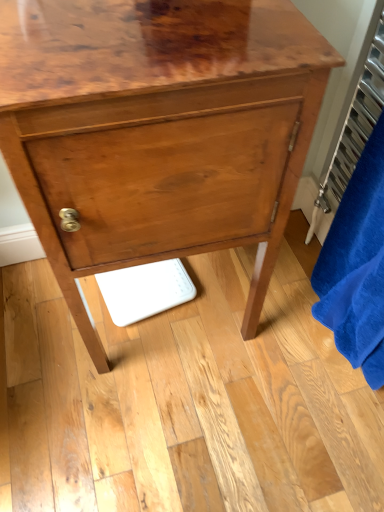
This screenshot has height=512, width=384. What are the coordinates of `blue plush bath towel at right` in the screenshot? It's located at (357, 266).

Measure the distance between metallic silver radiator at right and camera.

The depth of metallic silver radiator at right is 29.74 inches.

Consider the image. Measure the distance between point [130,2] and camera.

Point [130,2] is 24.37 inches away from camera.

The width and height of the screenshot is (384, 512). What are the coordinates of `blue plush bath towel at right` in the screenshot? It's located at (357, 266).

Can we say glossy wood chest of drawers at center lies outside metallic silver radiator at right?

Yes, glossy wood chest of drawers at center is not within metallic silver radiator at right.

From the image's perspective, is glossy wood chest of drawers at center above or below metallic silver radiator at right?

glossy wood chest of drawers at center is below metallic silver radiator at right.

Is glossy wood chest of drawers at center wider than metallic silver radiator at right?

Yes.

Considering the positions of points (108, 1) and (370, 60), is point (108, 1) closer to camera compared to point (370, 60)?

Yes, it is.

Looking at this image, from the image's perspective, is metallic silver radiator at right under glossy wood chest of drawers at center?

No.

Consider the image. Considering the relative positions of metallic silver radiator at right and glossy wood chest of drawers at center in the image provided, is metallic silver radiator at right to the left or to the right of glossy wood chest of drawers at center?

From the image, it's evident that metallic silver radiator at right is to the right of glossy wood chest of drawers at center.

Is metallic silver radiator at right situated inside glossy wood chest of drawers at center or outside?

metallic silver radiator at right is outside glossy wood chest of drawers at center.

Is metallic silver radiator at right facing towards glossy wood chest of drawers at center?

Yes, metallic silver radiator at right faces towards glossy wood chest of drawers at center.

Could blue plush bath towel at right be considered to be inside metallic silver radiator at right?

No, blue plush bath towel at right is located outside of metallic silver radiator at right.

Can you confirm if metallic silver radiator at right is taller than blue plush bath towel at right?

In fact, metallic silver radiator at right may be shorter than blue plush bath towel at right.

Who is more distant, metallic silver radiator at right or blue plush bath towel at right?

metallic silver radiator at right is more distant.

Consider the image. Is the surface of metallic silver radiator at right in direct contact with blue plush bath towel at right?

They are not placed beside each other.

Considering their positions, is blue plush bath towel at right located in front of or behind glossy wood chest of drawers at center?

blue plush bath towel at right is positioned closer to the viewer than glossy wood chest of drawers at center.

Who is taller, blue plush bath towel at right or glossy wood chest of drawers at center?

glossy wood chest of drawers at center.

From a real-world perspective, is blue plush bath towel at right physically located above or below glossy wood chest of drawers at center?

blue plush bath towel at right is above glossy wood chest of drawers at center.

From the image's perspective, which one is positioned higher, blue plush bath towel at right or glossy wood chest of drawers at center?

glossy wood chest of drawers at center appears higher in the image.

Is glossy wood chest of drawers at center oriented away from blue plush bath towel at right?

No, glossy wood chest of drawers at center's orientation is not away from blue plush bath towel at right.

Consider the image. Considering the relative sizes of glossy wood chest of drawers at center and blue plush bath towel at right in the image provided, is glossy wood chest of drawers at center taller than blue plush bath towel at right?

Indeed, glossy wood chest of drawers at center has a greater height compared to blue plush bath towel at right.

From a real-world perspective, does glossy wood chest of drawers at center sit lower than blue plush bath towel at right?

Yes, from a real-world perspective, glossy wood chest of drawers at center is under blue plush bath towel at right.

From the image's perspective, does blue plush bath towel at right appear higher than metallic silver radiator at right?

No, from the image's perspective, blue plush bath towel at right is not above metallic silver radiator at right.

In terms of height, does blue plush bath towel at right look taller or shorter compared to metallic silver radiator at right?

blue plush bath towel at right is taller than metallic silver radiator at right.

Could you tell me if blue plush bath towel at right is facing metallic silver radiator at right?

No, blue plush bath towel at right does not turn towards metallic silver radiator at right.

From a real-world perspective, relative to metallic silver radiator at right, is blue plush bath towel at right vertically above or below?

From a real-world perspective, blue plush bath towel at right is physically below metallic silver radiator at right.

The width and height of the screenshot is (384, 512). Find the location of `chest of drawers below the metallic silver radiator at right (from the image's perspective)`. chest of drawers below the metallic silver radiator at right (from the image's perspective) is located at coordinates (158, 130).

Find the location of a particular element. This screenshot has width=384, height=512. radiator that is above the glossy wood chest of drawers at center (from a real-world perspective) is located at coordinates (353, 127).

When comparing their distances from glossy wood chest of drawers at center, does metallic silver radiator at right or blue plush bath towel at right seem closer?

Based on the image, blue plush bath towel at right appears to be nearer to glossy wood chest of drawers at center.

When comparing their distances from metallic silver radiator at right, does blue plush bath towel at right or glossy wood chest of drawers at center seem closer?

The object closer to metallic silver radiator at right is blue plush bath towel at right.

Considering their positions, is metallic silver radiator at right positioned further to blue plush bath towel at right than glossy wood chest of drawers at center?

glossy wood chest of drawers at center is positioned further to the anchor blue plush bath towel at right.

Looking at the image, which one is located further to blue plush bath towel at right, glossy wood chest of drawers at center or metallic silver radiator at right?

glossy wood chest of drawers at center is further to blue plush bath towel at right.

When comparing their distances from glossy wood chest of drawers at center, does blue plush bath towel at right or metallic silver radiator at right seem further?

Among the two, metallic silver radiator at right is located further to glossy wood chest of drawers at center.

Based on the photo, which object lies nearer to the anchor point metallic silver radiator at right, glossy wood chest of drawers at center or blue plush bath towel at right?

blue plush bath towel at right.

I want to click on bath towel between glossy wood chest of drawers at center and metallic silver radiator at right, so click(357, 266).